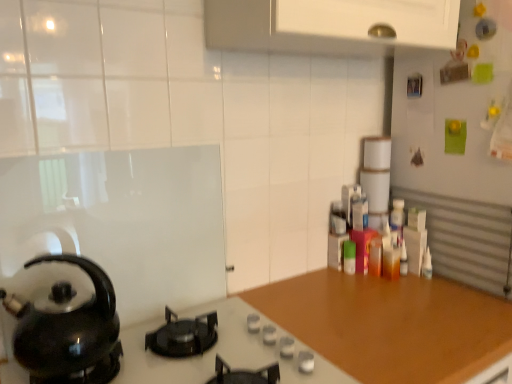
At what (x,y) coordinates should I click in order to perform the action: click on black matte gas stove at center. Please return your answer as a coordinate pair (x, y). This screenshot has height=384, width=512. Looking at the image, I should click on (217, 352).

What is the approximate width of black matte gas stove at center?

The width of black matte gas stove at center is 21.40 inches.

Locate an element on the screen. The width and height of the screenshot is (512, 384). wooden at center is located at coordinates (390, 325).

Locate an element on the screen. The height and width of the screenshot is (384, 512). black matte gas stove at center is located at coordinates (217, 352).

Is black matte gas stove at center next to black glossy kettle at left and touching it?

black matte gas stove at center and black glossy kettle at left are not in contact.

Measure the distance between black matte gas stove at center and black glossy kettle at left.

A distance of 7.25 inches exists between black matte gas stove at center and black glossy kettle at left.

The width and height of the screenshot is (512, 384). I want to click on kitchen appliance located above the black matte gas stove at center (from a real-world perspective), so click(68, 330).

Is black matte gas stove at center to the left of black glossy kettle at left from the viewer's perspective?

No.

Is wooden at center inside the boundaries of black matte gas stove at center, or outside?

wooden at center is spatially situated outside black matte gas stove at center.

From the picture: Does wooden at center appear on the left side of black matte gas stove at center?

No.

What's the angular difference between wooden at center and black matte gas stove at center's facing directions?

There is a 0.582-degree angle between the facing directions of wooden at center and black matte gas stove at center.

Looking at this image, considering the relative sizes of wooden at center and black matte gas stove at center in the image provided, is wooden at center taller than black matte gas stove at center?

Yes, wooden at center is taller than black matte gas stove at center.

Considering the positions of objects black glossy kettle at left and wooden at center in the image provided, who is behind, black glossy kettle at left or wooden at center?

wooden at center is behind.

From a real-world perspective, is black glossy kettle at left over wooden at center?

Yes, from a real-world perspective, black glossy kettle at left is above wooden at center.

From the image's perspective, is black glossy kettle at left located above wooden at center?

Yes, from the image's perspective, black glossy kettle at left is above wooden at center.

Does point (106, 291) come in front of point (392, 292)?

Yes.

In terms of width, does black matte gas stove at center look wider or thinner when compared to wooden at center?

Considering their sizes, black matte gas stove at center looks slimmer than wooden at center.

In the scene shown: Which point is more forward, [232,355] or [408,341]?

The point [232,355] is closer.

I want to click on countertop that is on the right side of black matte gas stove at center, so click(390, 325).

Which object is closer to the camera taking this photo, black matte gas stove at center or wooden at center?

Positioned in front is black matte gas stove at center.

Based on the photo, does black glossy kettle at left contain black matte gas stove at center?

Actually, black matte gas stove at center is outside black glossy kettle at left.

Considering the sizes of objects black glossy kettle at left and black matte gas stove at center in the image provided, who is bigger, black glossy kettle at left or black matte gas stove at center?

With larger size is black matte gas stove at center.

Based on the photo, is black glossy kettle at left oriented towards black matte gas stove at center?

No.

Looking at this image, what's the angular difference between wooden at center and black glossy kettle at left's facing directions?

There is a 2.63-degree angle between the facing directions of wooden at center and black glossy kettle at left.

Considering the positions of objects wooden at center and black glossy kettle at left in the image provided, who is more to the left, wooden at center or black glossy kettle at left?

From the viewer's perspective, black glossy kettle at left appears more on the left side.

Consider the image. Does wooden at center turn towards black glossy kettle at left?

No, wooden at center is not oriented towards black glossy kettle at left.

Find the location of `gas stove that is in front of the black glossy kettle at left`. gas stove that is in front of the black glossy kettle at left is located at coordinates (217, 352).

Where is `gas stove positioned vertically above the wooden at center (from a real-world perspective)`? This screenshot has width=512, height=384. gas stove positioned vertically above the wooden at center (from a real-world perspective) is located at coordinates [217, 352].

Considering their positions, is black matte gas stove at center positioned closer to wooden at center than black glossy kettle at left?

black matte gas stove at center.

Looking at the image, which one is located closer to black glossy kettle at left, wooden at center or black matte gas stove at center?

Based on the image, black matte gas stove at center appears to be nearer to black glossy kettle at left.

Considering their positions, is black glossy kettle at left positioned closer to wooden at center than black matte gas stove at center?

Among the two, black matte gas stove at center is located nearer to wooden at center.

Considering their positions, is black glossy kettle at left positioned closer to black matte gas stove at center than wooden at center?

Among the two, wooden at center is located nearer to black matte gas stove at center.

Which object lies nearer to the anchor point black glossy kettle at left, black matte gas stove at center or wooden at center?

black matte gas stove at center is closer to black glossy kettle at left.

Based on their spatial positions, is wooden at center or black glossy kettle at left closer to black matte gas stove at center?

Among the two, wooden at center is located nearer to black matte gas stove at center.

This screenshot has width=512, height=384. What are the coordinates of `gas stove situated between black glossy kettle at left and wooden at center from left to right` in the screenshot? It's located at (217, 352).